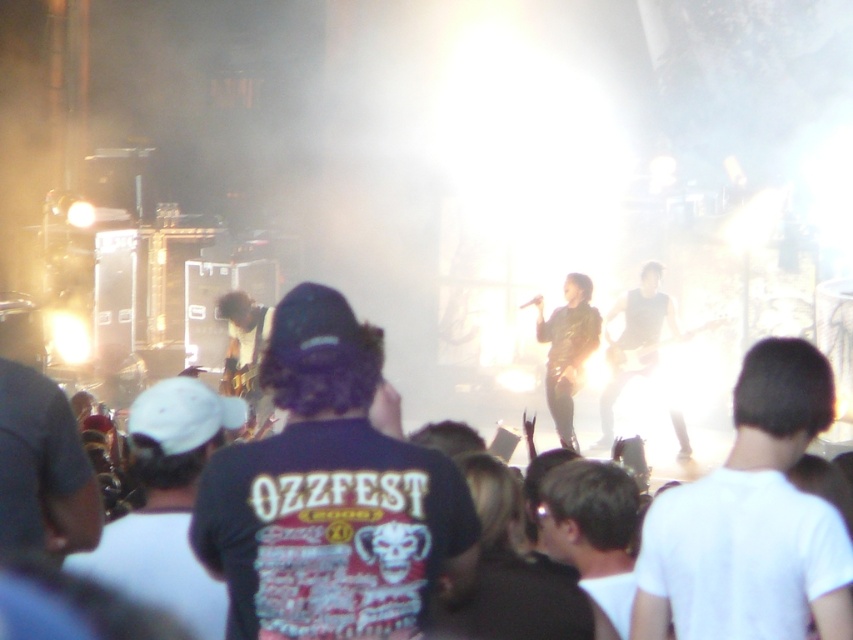
You are at the concert and want to take a photo of the shiny black guitar at center without the white matte shirt at center blocking the view. Is it possible to do so?

The white matte shirt at center is closer to the viewer than the shiny black guitar at center, so the shirt would block the view of the guitar. Therefore, it is not possible to take a photo of the shiny black guitar at center without the white matte shirt at center blocking the view.